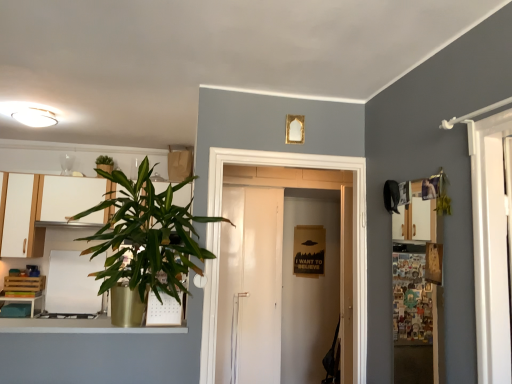
What do you see at coordinates (147, 238) in the screenshot? This screenshot has width=512, height=384. I see `green leafy plant at left, placed as the first houseplant when sorted from front to back` at bounding box center [147, 238].

Find the location of a particular element. white matte dry erase board at left is located at coordinates (72, 285).

Image resolution: width=512 pixels, height=384 pixels. Find the location of `green leafy plant at upper left, acting as the 2th houseplant starting from the front`. green leafy plant at upper left, acting as the 2th houseplant starting from the front is located at coordinates (105, 163).

Describe the element at coordinates (26, 303) in the screenshot. I see `wooden at left` at that location.

Locate an element on the screen. The image size is (512, 384). green leafy plant at left, placed as the first houseplant when sorted from front to back is located at coordinates (147, 238).

Is white matte dry erase board at left inside or outside of wooden at left?

white matte dry erase board at left is spatially situated outside wooden at left.

Does white matte dry erase board at left have a greater width compared to wooden at left?

No, white matte dry erase board at left is not wider than wooden at left.

Is white matte dry erase board at left oriented away from wooden at left?

No, wooden at left is not at the back of white matte dry erase board at left.

From the image's perspective, between white matte dry erase board at left and wooden at left, which one is located above?

white matte dry erase board at left, from the image's perspective.

Find the location of a particular element. cabinetry on the right of the matte white cabinet at left, the 2th cabinetry viewed from the right is located at coordinates (44, 208).

Consider the image. Between matte white cabinet at left, which appears as the 1th cabinetry when viewed from the left, and white matte cabinet at left, positioned as the first cabinetry in right-to-left order, which one has smaller width?

Thinner between the two is white matte cabinet at left, positioned as the first cabinetry in right-to-left order.

Is matte white cabinet at left, which appears as the 1th cabinetry when viewed from the left, closer to the viewer compared to white matte cabinet at left, the 2th cabinetry from the left?

Yes.

Which point is more distant from viewer, (31, 299) or (407, 241)?

Positioned behind is point (407, 241).

From the picture: Which object is further away from the camera taking this photo, wooden at left or wooden cutting board at upper right?

wooden at left is behind.

Are wooden at left and wooden cutting board at upper right located far from each other?

Yes, wooden at left and wooden cutting board at upper right are located far from each other.

Which is correct: wooden at left is inside wooden cutting board at upper right, or outside of it?

wooden at left is located beyond the bounds of wooden cutting board at upper right.

How different are the orientations of green leafy plant at left, placed as the 2th houseplant when sorted from top to bottom, and wooden at left in degrees?

The facing directions of green leafy plant at left, placed as the 2th houseplant when sorted from top to bottom, and wooden at left are 1.26 degrees apart.

From a real-world perspective, is green leafy plant at left, which is the 2th houseplant from back to front, over wooden at left?

Yes, from a real-world perspective, green leafy plant at left, which is the 2th houseplant from back to front, is above wooden at left.

Could you tell me if green leafy plant at left, which is the 2th houseplant from back to front, is facing wooden at left?

No, green leafy plant at left, which is the 2th houseplant from back to front, is not turned towards wooden at left.

How much distance is there between green leafy plant at left, placed as the 2th houseplant when sorted from top to bottom, and wooden at left?

green leafy plant at left, placed as the 2th houseplant when sorted from top to bottom, is 6.49 feet from wooden at left.

What's the angular difference between matte white cabinet at left, the 2th cabinetry viewed from the right, and wooden cutting board at upper right's facing directions?

The angle between the facing direction of matte white cabinet at left, the 2th cabinetry viewed from the right, and the facing direction of wooden cutting board at upper right is 89.4 degrees.

Looking at the image, does matte white cabinet at left, the 2th cabinetry viewed from the right, seem bigger or smaller compared to wooden cutting board at upper right?

In the image, matte white cabinet at left, the 2th cabinetry viewed from the right, appears to be larger than wooden cutting board at upper right.

Is matte white cabinet at left, the 2th cabinetry viewed from the right, facing towards wooden cutting board at upper right?

No, matte white cabinet at left, the 2th cabinetry viewed from the right, is not oriented towards wooden cutting board at upper right.

Does matte white cabinet at left, the 2th cabinetry viewed from the right, lie in front of wooden cutting board at upper right?

No.

From a real-world perspective, between wooden at left and white matte cabinet at left, the 2th cabinetry from the left, who is vertically lower?

wooden at left is physically lower.

From the image's perspective, is wooden at left positioned above or below white matte cabinet at left, positioned as the first cabinetry in right-to-left order?

Clearly, from the image's perspective, wooden at left is below white matte cabinet at left, positioned as the first cabinetry in right-to-left order.

Image resolution: width=512 pixels, height=384 pixels. Find the location of `table to the left of white matte cabinet at left, the 2th cabinetry from the left`. table to the left of white matte cabinet at left, the 2th cabinetry from the left is located at coordinates (26, 303).

Considering the points (106, 214) and (13, 314), which point is in front, point (106, 214) or point (13, 314)?

The point (106, 214) is closer to the camera.

From the image's perspective, is white matte cabinet at left, the 2th cabinetry from the left, over wooden at left?

Yes.

Considering the relative positions of white matte cabinet at left, the 2th cabinetry from the left, and wooden at left in the image provided, is white matte cabinet at left, the 2th cabinetry from the left, to the left or to the right of wooden at left?

In the image, white matte cabinet at left, the 2th cabinetry from the left, appears on the right side of wooden at left.

Can you tell me how much white matte cabinet at left, positioned as the first cabinetry in right-to-left order, and wooden at left differ in facing direction?

white matte cabinet at left, positioned as the first cabinetry in right-to-left order, and wooden at left are facing 0.502 degrees away from each other.

Where is `appliance above the wooden at left (from a real-world perspective)`? appliance above the wooden at left (from a real-world perspective) is located at coordinates (72, 285).

In the image, there is a matte white cabinet at left, the 2th cabinetry viewed from the right. Find the location of `cabinetry below it (from the image's perspective)`. cabinetry below it (from the image's perspective) is located at coordinates [x=44, y=208].

Which object lies further to the anchor point green leafy plant at upper left, which appears as the first houseplant when viewed from the top, white glossy door at center or wooden at left?

Among the two, white glossy door at center is located further to green leafy plant at upper left, which appears as the first houseplant when viewed from the top.

Considering their positions, is matte white cabinet at left, the 2th cabinetry viewed from the right, positioned closer to green leafy plant at upper left, the first houseplant viewed from the left, than wooden at left?

Among the two, matte white cabinet at left, the 2th cabinetry viewed from the right, is located nearer to green leafy plant at upper left, the first houseplant viewed from the left.

Which object lies nearer to the anchor point white matte cabinet at left, the 2th cabinetry from the left, wooden cutting board at upper right or green leafy plant at upper left, which is the 2th houseplant from bottom to top?

green leafy plant at upper left, which is the 2th houseplant from bottom to top, is closer to white matte cabinet at left, the 2th cabinetry from the left.

Which object lies further to the anchor point green leafy plant at upper left, which appears as the first houseplant when viewed from the top, wooden cutting board at upper right or green leafy plant at left, placed as the first houseplant when sorted from bottom to top?

wooden cutting board at upper right is further to green leafy plant at upper left, which appears as the first houseplant when viewed from the top.

Based on their spatial positions, is matte white cabinet at left, which appears as the 1th cabinetry when viewed from the left, or wooden cutting board at upper right closer to white glossy door at center?

wooden cutting board at upper right.

Estimate the real-world distances between objects in this image. Which object is further from wooden cutting board at upper right, green leafy plant at upper left, the 1th houseplant positioned from the back, or white matte dry erase board at left?

white matte dry erase board at left lies further to wooden cutting board at upper right than the other object.

Considering their positions, is white matte dry erase board at left positioned closer to white glossy door at center than wooden cutting board at upper right?

wooden cutting board at upper right lies closer to white glossy door at center than the other object.

From the image, which object appears to be farther from green leafy plant at upper left, which is the 2th houseplant from bottom to top, green leafy plant at left, placed as the second houseplant when sorted from left to right, or wooden cutting board at upper right?

wooden cutting board at upper right.

Find the location of a particular element. cabinetry located between wooden at left and wooden cutting board at upper right in the left-right direction is located at coordinates (44, 208).

Locate an element on the screen. The image size is (512, 384). cabinetry that lies between matte white cabinet at left, the 2th cabinetry viewed from the right, and wooden at left from top to bottom is located at coordinates (44, 208).

This screenshot has width=512, height=384. I want to click on cabinetry between matte white cabinet at left, the 2th cabinetry viewed from the right, and white matte dry erase board at left, in the vertical direction, so click(x=44, y=208).

Image resolution: width=512 pixels, height=384 pixels. Identify the location of door positioned between green leafy plant at left, placed as the first houseplant when sorted from bottom to top, and white matte dry erase board at left from near to far. (353, 221).